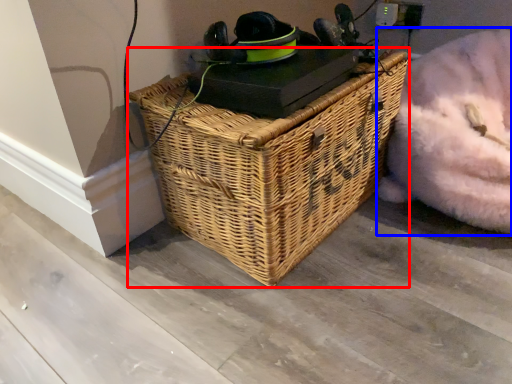
Question: Which of the following is the closest to the observer, picnic basket (highlighted by a red box) or bean bag chair (highlighted by a blue box)?

Choices:
 (A) picnic basket
 (B) bean bag chair

Answer: (A)